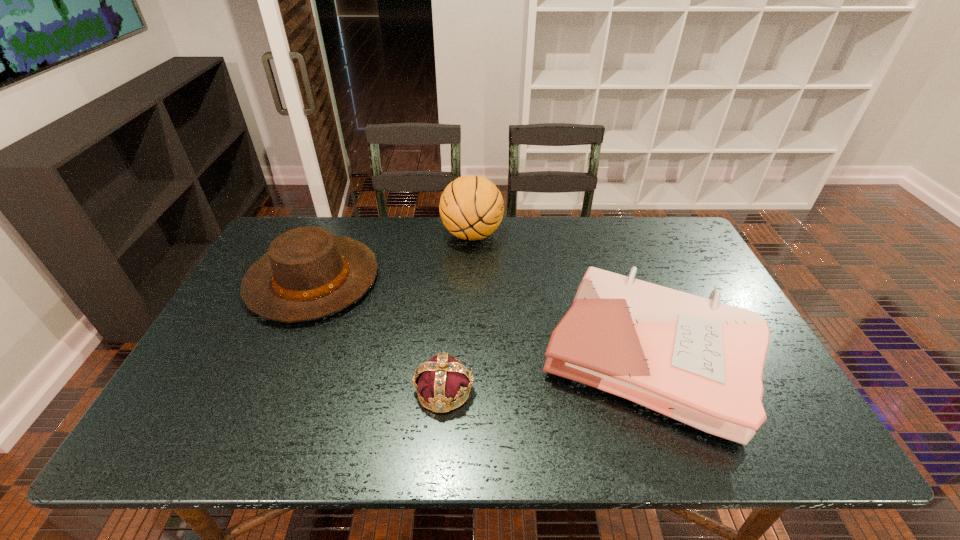
Locate an element on the screen. free area in between the rightmost object and the cowboy hat is located at coordinates (481, 318).

You are a GUI agent. You are given a task and a screenshot of the screen. Output one action in this format:
    pyautogui.click(x=<x>, y=<y>)
    Task: Click on the vacant area that lies between the phonebook and the crown
    This screenshot has height=540, width=960.
    Given the screenshot: What is the action you would take?
    pyautogui.click(x=546, y=374)

Locate an element on the screen. This screenshot has width=960, height=540. object that is the closest one to the basketball is located at coordinates (308, 273).

This screenshot has height=540, width=960. I want to click on the closest object to the rightmost object, so click(441, 380).

Where is `free space that satisfies the following two spatial constraints: 1. on the surface of the phonebook near the brand logo; 2. on the right side of the tallest object`? free space that satisfies the following two spatial constraints: 1. on the surface of the phonebook near the brand logo; 2. on the right side of the tallest object is located at coordinates (469, 356).